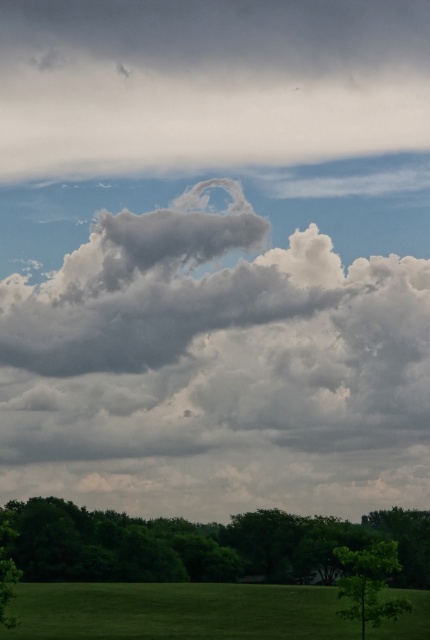
Is cloudy white at upper center shorter than green grass at bottom?

No.

Which is in front, point (390, 292) or point (190, 605)?

Point (190, 605) is more forward.

The width and height of the screenshot is (430, 640). What do you see at coordinates (209, 346) in the screenshot?
I see `cloudy white at upper center` at bounding box center [209, 346].

What are the coordinates of `cloudy white at upper center` in the screenshot? It's located at (209, 346).

Is gray fluffy cloud at upper center to the left of green leafy tree at lower center from the viewer's perspective?

Indeed, gray fluffy cloud at upper center is positioned on the left side of green leafy tree at lower center.

Does point (151, 163) lie in front of point (43, 508)?

No, it is not.

Who is more forward, (x=58, y=106) or (x=113, y=516)?

Positioned in front is point (x=113, y=516).

The width and height of the screenshot is (430, 640). Identify the location of gray fluffy cloud at upper center. (206, 84).

Is gray fluffy cloud at upper center bigger than green grass at bottom?

Indeed, gray fluffy cloud at upper center has a larger size compared to green grass at bottom.

Which is more to the left, gray fluffy cloud at upper center or green grass at bottom?

A: gray fluffy cloud at upper center

I want to click on gray fluffy cloud at upper center, so click(x=206, y=84).

You are a GUI agent. You are given a task and a screenshot of the screen. Output one action in this format:
    pyautogui.click(x=<x>, y=<y>)
    Task: Click on the gray fluffy cloud at upper center
    
    Given the screenshot: What is the action you would take?
    pyautogui.click(x=206, y=84)